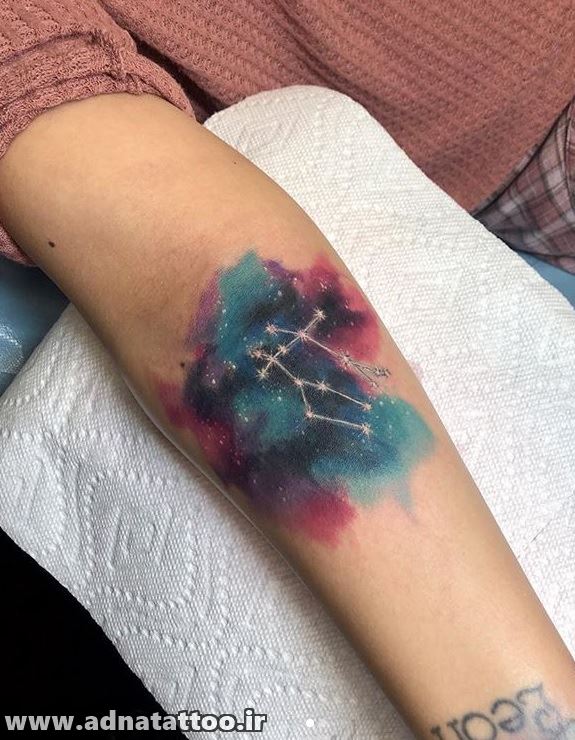
The height and width of the screenshot is (740, 575). I want to click on white paper towel, so click(x=266, y=642).